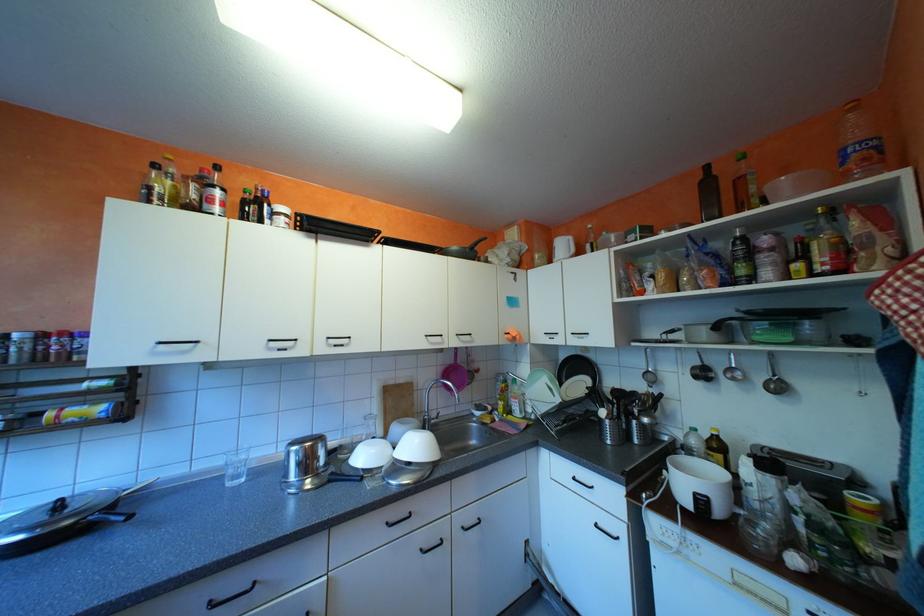
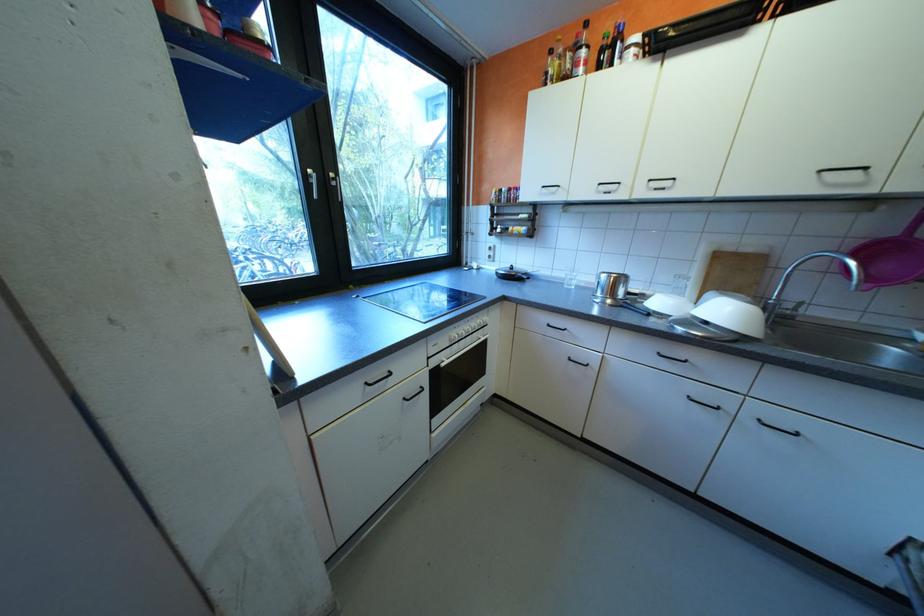
The point at [463,360] is marked in the first image. Where is the corresponding point in the second image?

(906, 231)